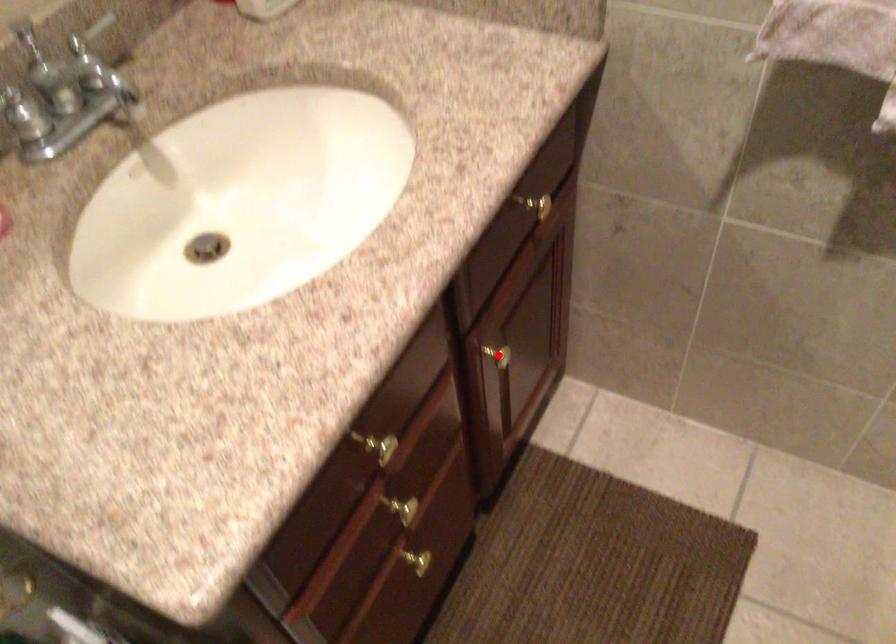
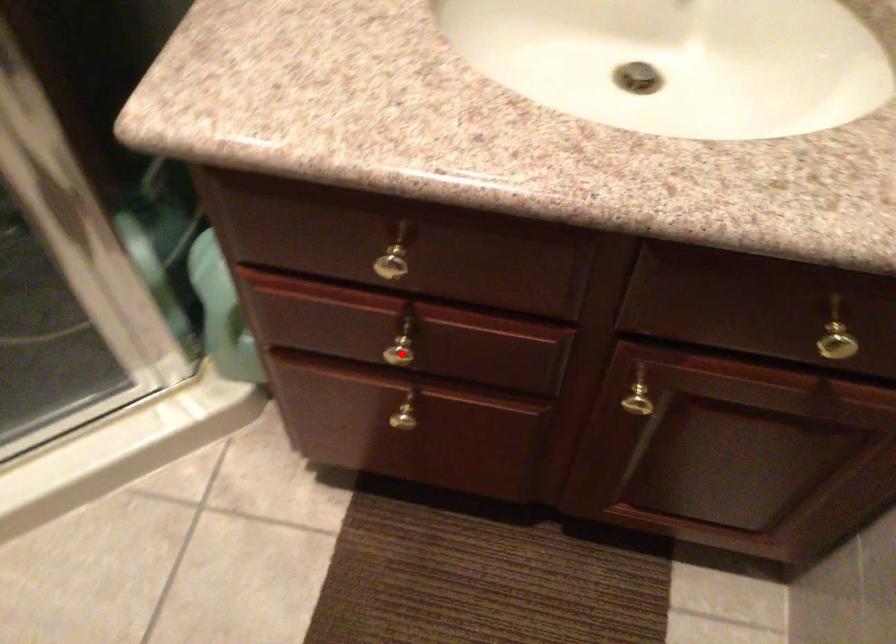
I am providing you with two images of the same scene from different viewpoints. A red point is marked on the first image and another point is marked on the second image. Does the point marked in image1 correspond to the same location as the one in image2?

No